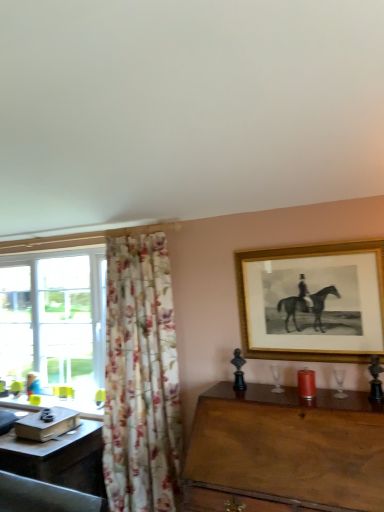
Locate an element on the screen. This screenshot has width=384, height=512. floral fabric curtain at left is located at coordinates (141, 378).

You are a GUI agent. You are given a task and a screenshot of the screen. Output one action in this format:
    pyautogui.click(x=<x>, y=<y>)
    Task: Click on the wooden desk at lower left
    The height and width of the screenshot is (512, 384).
    Given the screenshot: What is the action you would take?
    pyautogui.click(x=59, y=458)

What do you see at coordinates (33, 383) in the screenshot?
I see `blue fabric person at lower left` at bounding box center [33, 383].

This screenshot has width=384, height=512. Describe the element at coordinates (284, 451) in the screenshot. I see `wooden table at right` at that location.

What are the coordinates of `gold framed print at upper right` in the screenshot? It's located at (313, 301).

Where is `floral fabric curtain at left`? This screenshot has width=384, height=512. floral fabric curtain at left is located at coordinates (141, 378).

Is wooden desk at lower left in front of or behind gold framed print at upper right in the image?

wooden desk at lower left is positioned farther from the viewer than gold framed print at upper right.

What's the angular difference between wooden desk at lower left and gold framed print at upper right's facing directions?

They differ by 0.466 degrees in their facing directions.

From a real-world perspective, is wooden desk at lower left on gold framed print at upper right?

Actually, wooden desk at lower left is physically below gold framed print at upper right in the real world.

Which of these two, wooden desk at lower left or gold framed print at upper right, is wider?

wooden desk at lower left is wider.

Which is nearer, (64, 459) or (348, 401)?

Point (64, 459).

Which object is positioned more to the left, wooden desk at lower left or wooden table at right?

wooden desk at lower left is more to the left.

You are a GUI agent. You are given a task and a screenshot of the screen. Output one action in this format:
    pyautogui.click(x=<x>, y=<y>)
    Task: Click on the table in front of the wooden desk at lower left
    
    Given the screenshot: What is the action you would take?
    pos(284,451)

Which of these two, wooden desk at lower left or wooden table at right, is thinner?

Thinner between the two is wooden desk at lower left.

Can you see gold framed print at upper right touching floral fabric curtain at left?

There is a gap between gold framed print at upper right and floral fabric curtain at left.

Is gold framed print at upper right located outside floral fabric curtain at left?

gold framed print at upper right lies outside floral fabric curtain at left's area.

From a real-world perspective, which object stands above the other?

A: gold framed print at upper right.

Can you confirm if blue fabric person at lower left is smaller than matte black book at left?

Yes.

Which is in front, point (31, 383) or point (70, 429)?

The point (70, 429) is closer.

From a real-world perspective, which object stands above the other?

blue fabric person at lower left, from a real-world perspective.

Looking at this image, is blue fabric person at lower left taller or shorter than matte black book at left?

Considering their sizes, blue fabric person at lower left has more height than matte black book at left.

From their relative heights in the image, would you say gold framed print at upper right is taller or shorter than wooden table at right?

Considering their sizes, gold framed print at upper right has less height than wooden table at right.

Identify the location of table on the left side of gold framed print at upper right. (284, 451).

Between point (328, 349) and point (380, 487), which one is positioned behind?

The point (328, 349) is farther from the camera.

How far apart are matte black book at left and blue fabric person at lower left?

matte black book at left is 29.49 inches from blue fabric person at lower left.

From their relative heights in the image, would you say matte black book at left is taller or shorter than blue fabric person at lower left?

Considering their sizes, matte black book at left has less height than blue fabric person at lower left.

Considering the sizes of objects matte black book at left and blue fabric person at lower left in the image provided, who is wider, matte black book at left or blue fabric person at lower left?

Wider between the two is matte black book at left.

Looking at this image, can you confirm if matte black book at left is smaller than blue fabric person at lower left?

Actually, matte black book at left might be larger than blue fabric person at lower left.

Identify the location of box below the floral fabric curtain at left (from the image's perspective). (47, 424).

Is point (28, 430) closer to viewer compared to point (170, 484)?

No.

Is matte black book at left oriented towards floral fabric curtain at left?

No.

From a real-world perspective, who is located higher, matte black book at left or floral fabric curtain at left?

floral fabric curtain at left is physically above.

Locate an element on the screen. The image size is (384, 512). picture frame in front of the wooden desk at lower left is located at coordinates (313, 301).

This screenshot has height=512, width=384. I want to click on table that appears on the right of wooden desk at lower left, so click(284, 451).

From the image, which object appears to be nearer to gold framed print at upper right, wooden desk at lower left or blue fabric person at lower left?

wooden desk at lower left is positioned closer to the anchor gold framed print at upper right.

Based on their spatial positions, is floral fabric curtain at left or gold framed print at upper right closer to blue fabric person at lower left?

floral fabric curtain at left is closer to blue fabric person at lower left.

Estimate the real-world distances between objects in this image. Which object is further from wooden table at right, wooden desk at lower left or floral fabric curtain at left?

wooden desk at lower left lies further to wooden table at right than the other object.

Which object lies further to the anchor point blue fabric person at lower left, wooden desk at lower left or matte black book at left?

wooden desk at lower left is positioned further to the anchor blue fabric person at lower left.

Based on their spatial positions, is floral fabric curtain at left or matte black book at left closer to wooden desk at lower left?

matte black book at left is closer to wooden desk at lower left.

Looking at the image, which one is located closer to floral fabric curtain at left, wooden table at right or matte black book at left?

Among the two, matte black book at left is located nearer to floral fabric curtain at left.

Which object lies further to the anchor point wooden table at right, floral fabric curtain at left or blue fabric person at lower left?

blue fabric person at lower left is positioned further to the anchor wooden table at right.

Based on their spatial positions, is blue fabric person at lower left or wooden table at right closer to matte black book at left?

Based on the image, blue fabric person at lower left appears to be nearer to matte black book at left.

Where is `box between blue fabric person at lower left and gold framed print at upper right in the horizontal direction`? The width and height of the screenshot is (384, 512). box between blue fabric person at lower left and gold framed print at upper right in the horizontal direction is located at coordinates (47, 424).

Where is `curtain between blue fabric person at lower left and gold framed print at upper right in the horizontal direction`? curtain between blue fabric person at lower left and gold framed print at upper right in the horizontal direction is located at coordinates (141, 378).

Where is `table between blue fabric person at lower left and gold framed print at upper right`? The width and height of the screenshot is (384, 512). table between blue fabric person at lower left and gold framed print at upper right is located at coordinates (284, 451).

You are a GUI agent. You are given a task and a screenshot of the screen. Output one action in this format:
    pyautogui.click(x=<x>, y=<y>)
    Task: Click on the desk between floral fabric curtain at left and blue fabric person at lower left along the z-axis
    
    Given the screenshot: What is the action you would take?
    pyautogui.click(x=59, y=458)